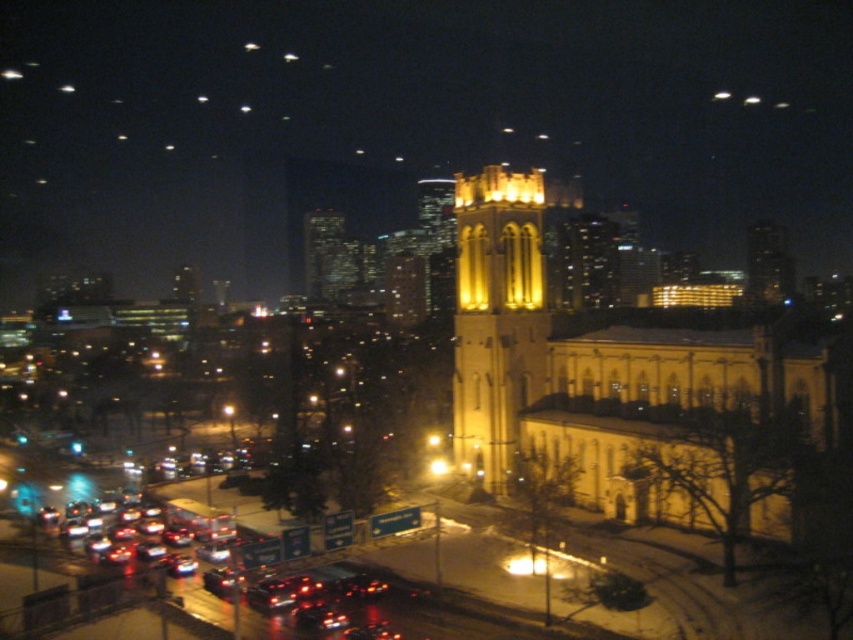
You are a photographer trying to capture the yellow stone church at center and the shiny black car at lower left in the same frame. Given their relative sizes, which object should you focus on first to ensure both are clearly visible in your photo?

The yellow stone church at center is much taller than the shiny black car at lower left, so you should focus on the yellow stone church at center first to ensure its details are sharp, then adjust for the car.

From the picture: You are standing at the point closest to the church tower. Which of the two points, point (531, 314) or point (71, 611), is farther away from you?

Point (531, 314) is farther away because it is behind point (71, 611), which is closer to you.

You are standing at the center of the busy street in front of the church. Which direction should you look to see the yellow stone tower at center?

The yellow stone tower at center is located at point (496, 317), so you should look directly ahead since it is centered in the scene.